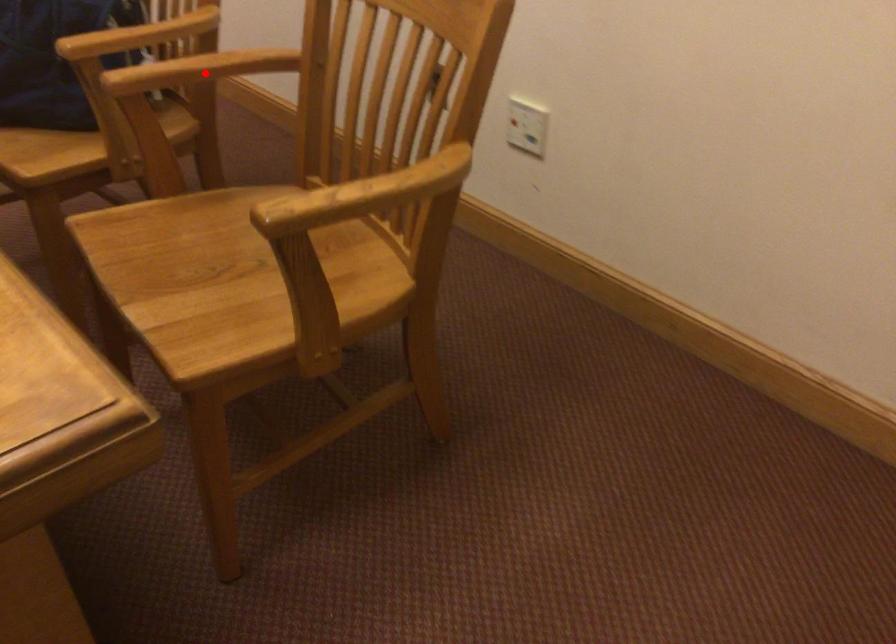
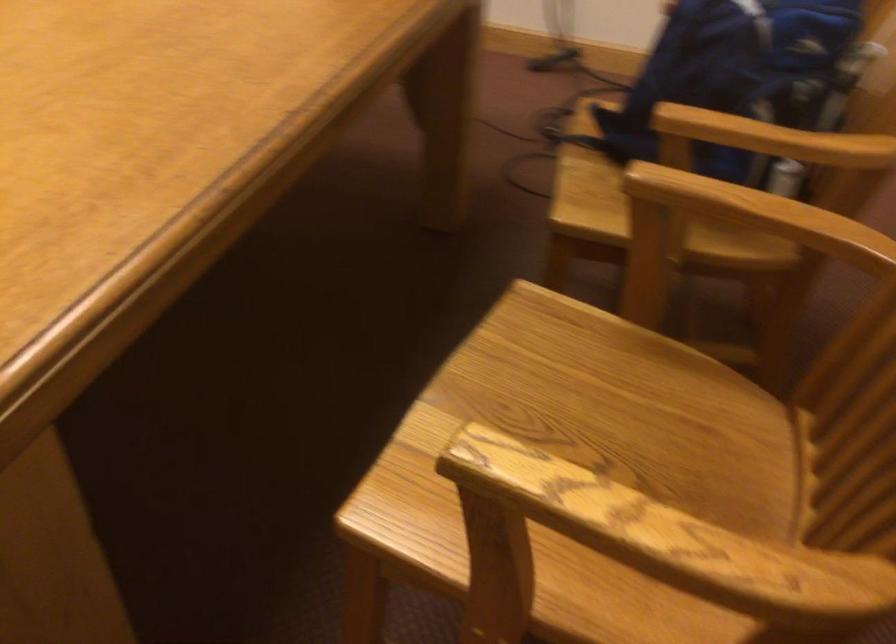
In the second image, find the point that corresponds to the highlighted location in the first image.

(743, 223)